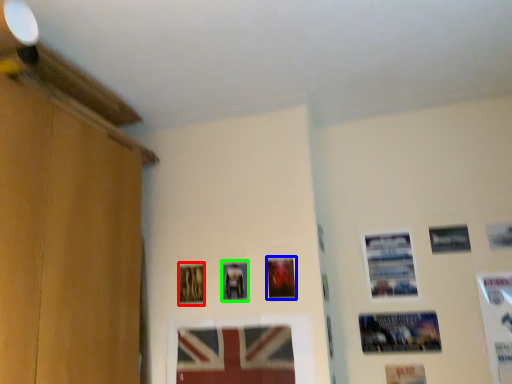
Question: Based on their relative distances, which object is nearer to picture frame (highlighted by a red box)? Choose from picture frame (highlighted by a blue box) and picture frame (highlighted by a green box).

Choices:
 (A) picture frame
 (B) picture frame

Answer: (B)